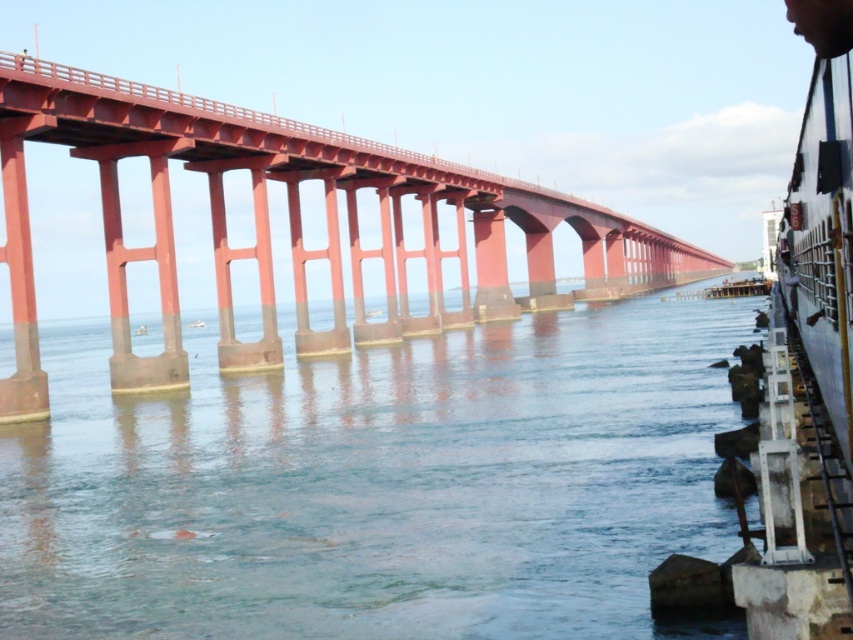
You are a photographer trying to capture the entire smooth red bridge at center and clear water at center in a single shot. Based on their sizes, which one will occupy more of the frame?

The smooth red bridge at center is larger than the clear water at center, so it will occupy more of the frame.

You are standing on the bridge and want to take a photo of both point (438, 470) and point (405, 180). Which point will appear larger in your camera view?

Point (438, 470) will appear larger in the camera view because it is closer to the camera than point (405, 180).